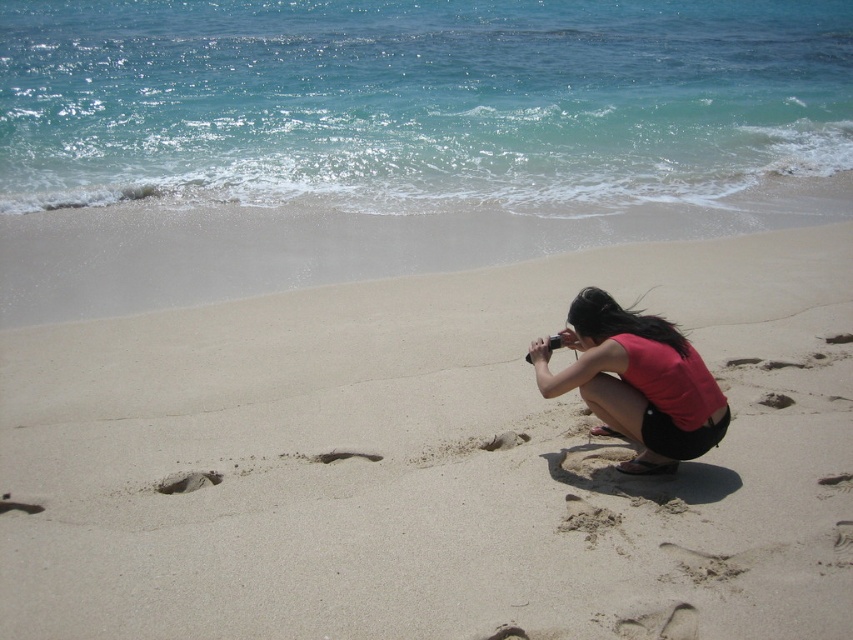
Question: Considering the real-world distances, which object is farthest from the brown sandy footprint at center?

Choices:
 (A) brown sandy footprint at lower left
 (B) beige sand at center

Answer: (B)

Question: Does beige sand at center have a larger size compared to brown sandy footprint at center?

Choices:
 (A) yes
 (B) no

Answer: (A)

Question: Observing the image, what is the correct spatial positioning of matte red shirt at lower right in reference to brown sandy footprint at lower center?

Choices:
 (A) below
 (B) above

Answer: (B)

Question: Does beige sand at center have a lesser width compared to brown sandy footprint at lower left?

Choices:
 (A) no
 (B) yes

Answer: (A)

Question: Which of the following is the farthest from the observer?

Choices:
 (A) (373, 460)
 (B) (183, 483)
 (C) (782, 396)

Answer: (C)

Question: Considering the real-world distances, which object is closest to the matte red shirt at lower right?

Choices:
 (A) brown sandy footprint at lower left
 (B) beige sand at center
 (C) brown sandy footprint at center

Answer: (C)